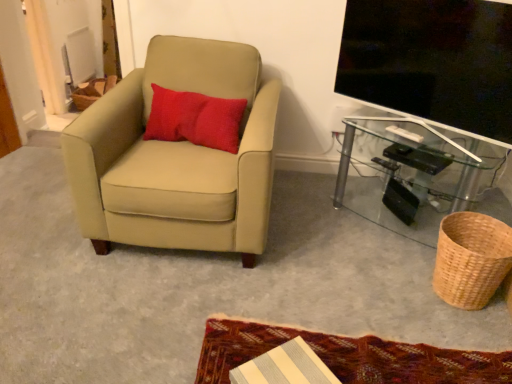
I want to click on vacant space to the left of woven natural basket at lower right, so click(392, 280).